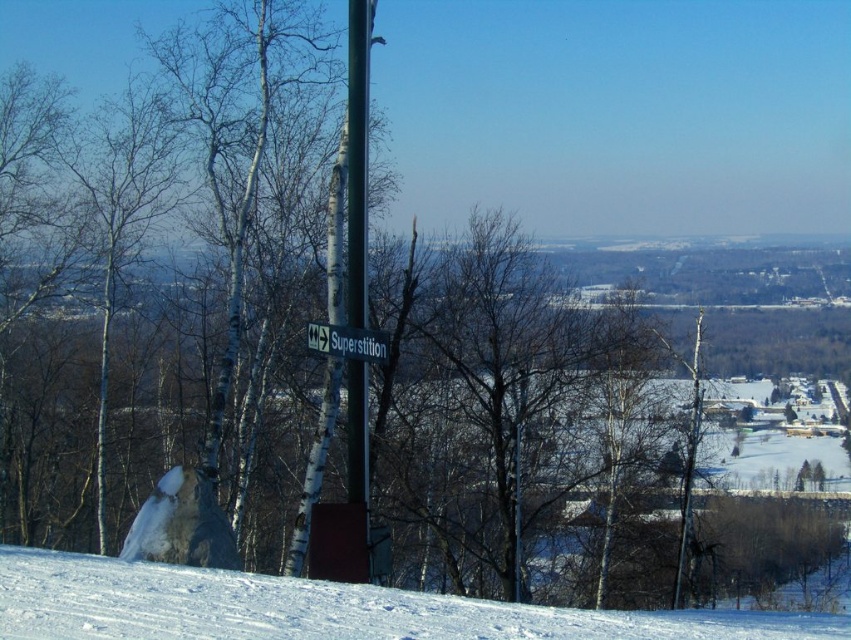
Which of these two, white powdery snow at lower center or white plastic street sign at center, stands shorter?

white powdery snow at lower center is shorter.

Between white powdery snow at lower center and white plastic street sign at center, which one is positioned lower?

Positioned lower is white powdery snow at lower center.

Who is more forward, (370, 632) or (350, 333)?

Point (370, 632)

Where is `white powdery snow at lower center`? white powdery snow at lower center is located at coordinates (320, 609).